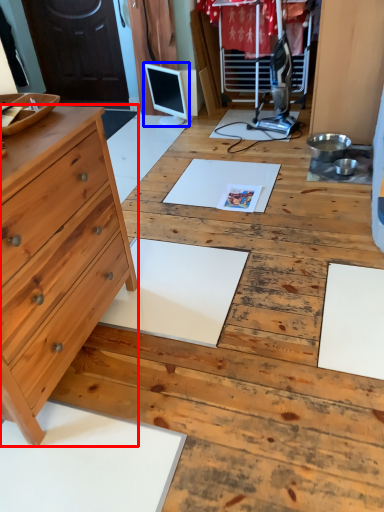
Question: Which object appears farthest to the camera in this image, chest of drawers (highlighted by a red box) or computer monitor (highlighted by a blue box)?

Choices:
 (A) chest of drawers
 (B) computer monitor

Answer: (B)